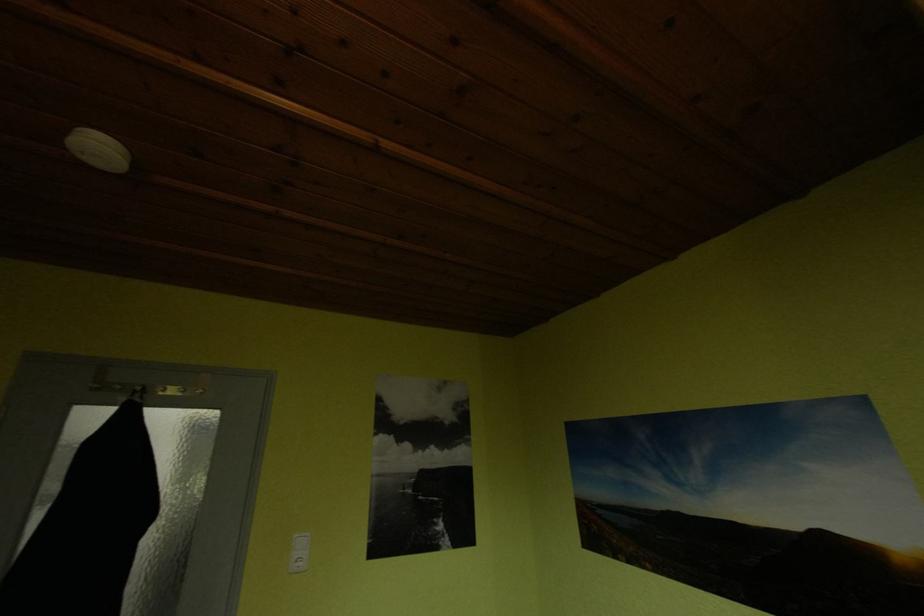
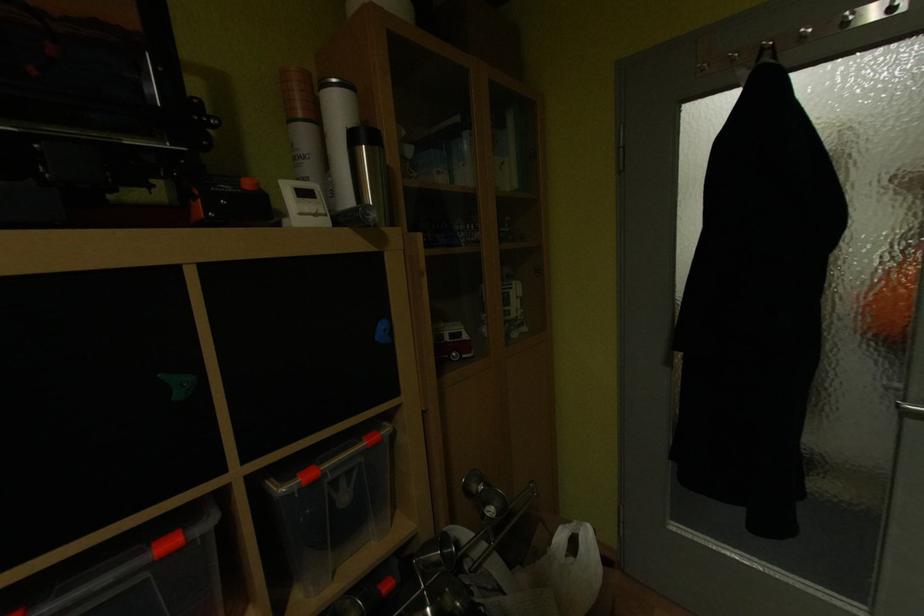
How did the camera likely rotate?

The camera rotated toward left-down.